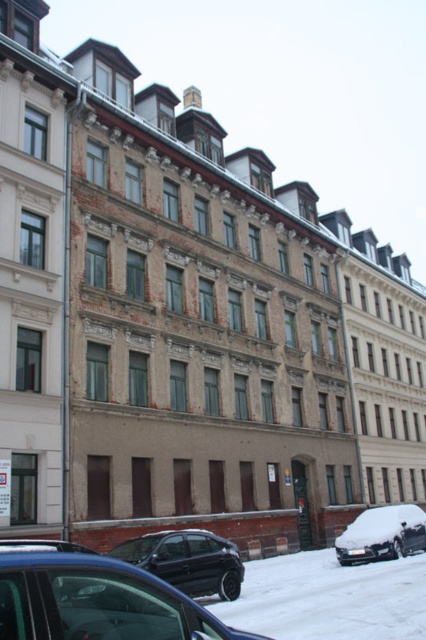
Can you confirm if shiny black car at lower left is positioned below shiny black sedan at lower left?

No, shiny black car at lower left is not below shiny black sedan at lower left.

Describe the element at coordinates (97, 602) in the screenshot. I see `shiny black car at lower left` at that location.

Locate an element on the screen. shiny black car at lower left is located at coordinates (97, 602).

Does point (184, 566) lie behind point (420, 515)?

That is False.

Who is more forward, (238, 579) or (360, 524)?

Point (238, 579) is in front.

Locate an element on the screen. shiny black sedan at lower left is located at coordinates (187, 561).

Can you confirm if shiny black car at lower left is thinner than snow-covered car at lower right?

Correct, shiny black car at lower left's width is less than snow-covered car at lower right's.

Does shiny black car at lower left appear on the left side of snow-covered car at lower right?

Yes, shiny black car at lower left is to the left of snow-covered car at lower right.

Does point (22, 625) come farther from viewer compared to point (409, 508)?

No, (22, 625) is closer to viewer.

Where is `shiny black car at lower left`? The width and height of the screenshot is (426, 640). shiny black car at lower left is located at coordinates [x=97, y=602].